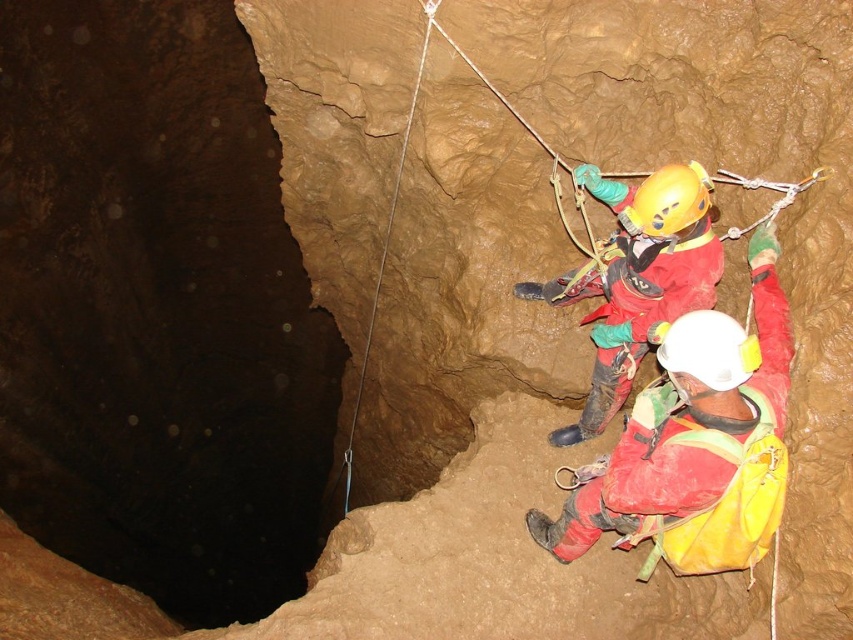
Question: Does red matte helmet at right appear under yellow matte helmet at center?

Choices:
 (A) yes
 (B) no

Answer: (A)

Question: Considering the real-world distances, which object is farthest from the white matte helmet at center?

Choices:
 (A) red fabric helmet at center
 (B) yellow matte helmet at center

Answer: (A)

Question: Does red matte helmet at right have a greater width compared to yellow matte helmet at center?

Choices:
 (A) no
 (B) yes

Answer: (B)

Question: Which object is the closest to the red fabric helmet at center?

Choices:
 (A) red matte helmet at right
 (B) white matte helmet at center
 (C) yellow matte helmet at center

Answer: (C)

Question: Which object appears closest to the camera in this image?

Choices:
 (A) red fabric helmet at center
 (B) yellow matte helmet at center
 (C) white matte helmet at center
 (D) red matte helmet at right

Answer: (C)

Question: Is red matte helmet at right to the right of white matte helmet at center from the viewer's perspective?

Choices:
 (A) no
 (B) yes

Answer: (B)